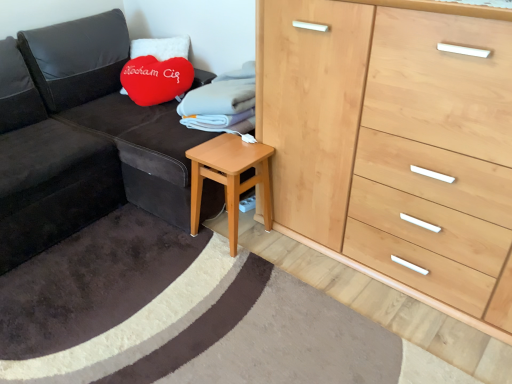
At what (x,y) coordinates should I click in order to perform the action: click on free space above light brown wooden stool at lower center (from a real-world perspective). Please return your answer as a coordinate pair (x, y). The height and width of the screenshot is (384, 512). Looking at the image, I should click on (218, 149).